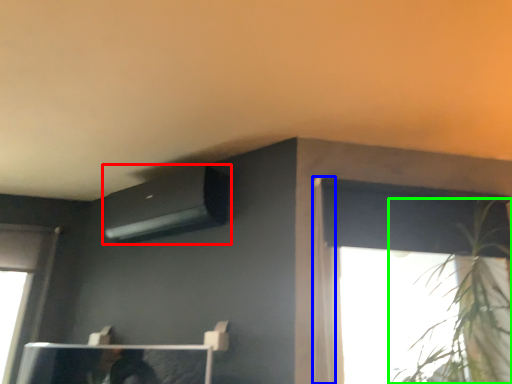
Question: Considering the real-world distances, which object is farthest from air conditioning (highlighted by a red box)? curtain (highlighted by a blue box) or houseplant (highlighted by a green box)?

Choices:
 (A) curtain
 (B) houseplant

Answer: (B)